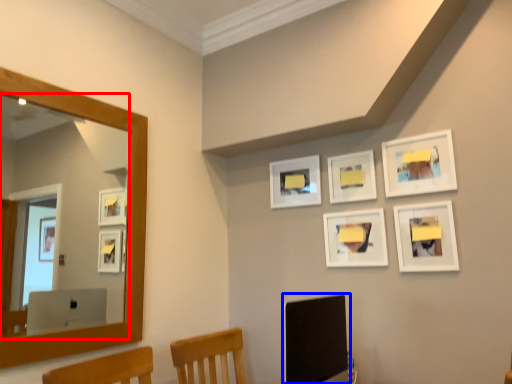
Question: Which object is further to the camera taking this photo, mirror (highlighted by a red box) or computer monitor (highlighted by a blue box)?

Choices:
 (A) mirror
 (B) computer monitor

Answer: (A)